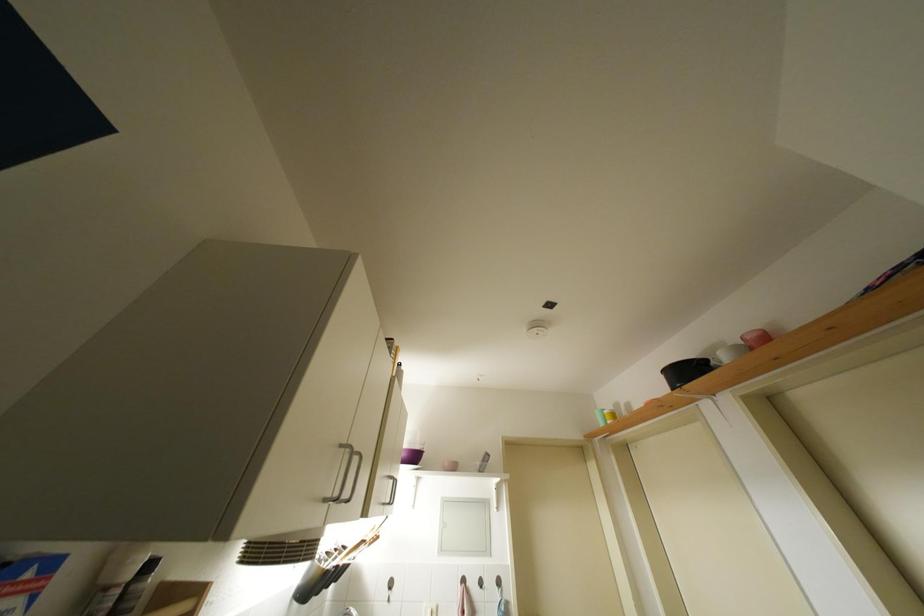
Image resolution: width=924 pixels, height=616 pixels. Identify the location of white mug. (730, 353).